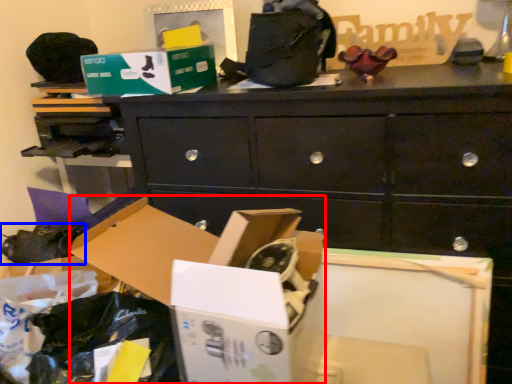
Question: Which point is closer to the camera, storage box (highlighted by a red box) or shoe (highlighted by a blue box)?

Choices:
 (A) storage box
 (B) shoe

Answer: (A)